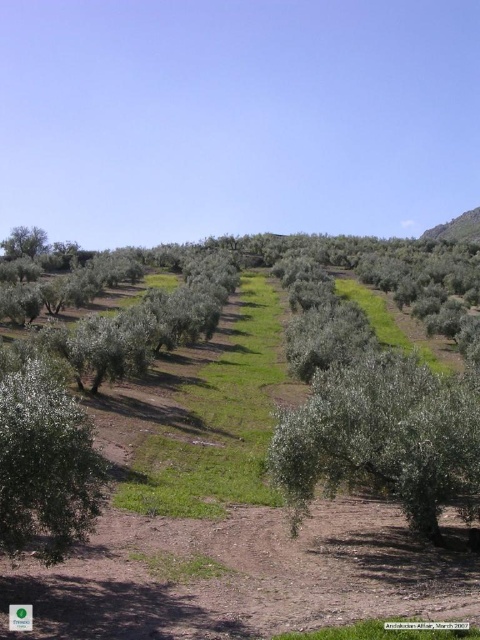
Question: Observing the image, what is the correct spatial positioning of green leafy tree at lower left in reference to green leafy tree at left?

Choices:
 (A) right
 (B) left

Answer: (A)

Question: Which is farther from the green leafy tree at left?

Choices:
 (A) green leafy tree at center
 (B) green leafy tree at lower left

Answer: (B)

Question: Can you confirm if green leafy tree at center is wider than green leafy tree at lower left?

Choices:
 (A) yes
 (B) no

Answer: (A)

Question: Which point is closer to the camera taking this photo?

Choices:
 (A) (1, 244)
 (B) (436, 460)

Answer: (B)

Question: Is the position of green leafy tree at center more distant than that of green leafy tree at left?

Choices:
 (A) no
 (B) yes

Answer: (A)

Question: Which of these objects is positioned closest to the green leafy tree at center?

Choices:
 (A) green leafy tree at lower left
 (B) green leafy tree at left

Answer: (A)